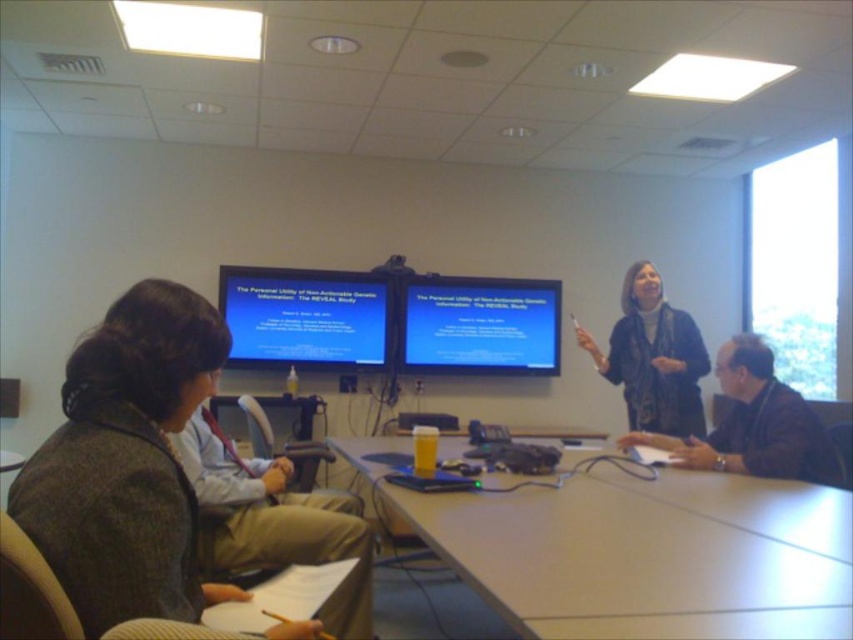
Who is lower down, smooth light brown table at center or dark gray wool jacket at lower left?

smooth light brown table at center is below.

In the scene shown: Which of these two, smooth light brown table at center or dark gray wool jacket at lower left, stands shorter?

With less height is smooth light brown table at center.

The height and width of the screenshot is (640, 853). In order to click on smooth light brown table at center in this screenshot , I will do `click(637, 550)`.

Is matte black screen at upper center to the left of matte black scarf at upper right from the viewer's perspective?

Yes, matte black screen at upper center is to the left of matte black scarf at upper right.

I want to click on matte black screen at upper center, so click(x=306, y=317).

Image resolution: width=853 pixels, height=640 pixels. I want to click on matte black screen at upper center, so click(306, 317).

Which of these two, blue glossy projector screen at center or brown leather jacket at right, stands shorter?

Standing shorter between the two is brown leather jacket at right.

Between point (521, 314) and point (724, 380), which one is positioned behind?

The point (521, 314) is more distant.

The width and height of the screenshot is (853, 640). I want to click on blue glossy projector screen at center, so click(480, 324).